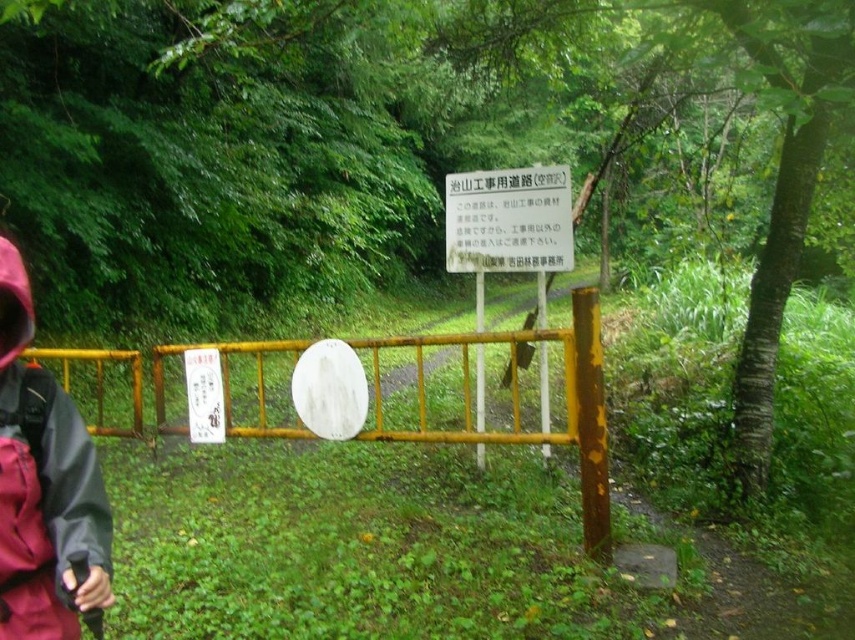
You are a hiker who has just arrived at the forest path. You see a red waterproof jacket at left and a white paper sign at center. Which object is taller?

The red waterproof jacket at left is much taller than the white paper sign at center.

You are a hiker carrying a 12 feet long tent pole. You need to place both the red waterproof jacket at left and the white paper sign at center on the ground without the tent pole overlapping them. Is this possible?

The red waterproof jacket at left and white paper sign at center are 13.43 feet apart from each other. Since the tent pole is 12 feet long, placing them with at least 13.43 feet between them would require the pole to span the distance between them, which is longer than the pole itself. Therefore, it is not possible to place both items without the tent pole overlapping them.

You are standing at the yellow metal gate in the forest. There are two points marked on the dirt path ahead of you. The first point is at coordinates point (4, 244) and the second is at point (541, 195). If you were to walk towards the second point, would you pass by the first point before reaching it?

Yes, you would pass by the first point at point (4, 244) before reaching the second point at point (541, 195) because the first point is in front of the second point according to the spatial description provided.